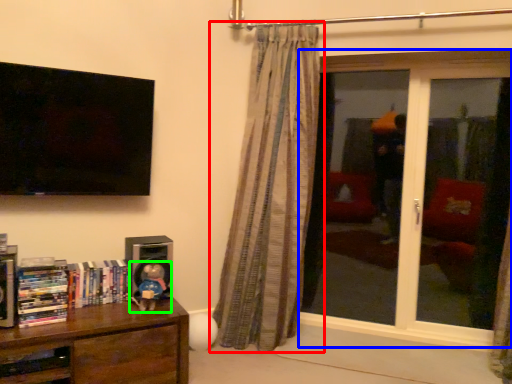
Question: Based on their relative distances, which object is farther from curtain (highlighted by a red box)? Choose from window (highlighted by a blue box) and toy (highlighted by a green box).

Choices:
 (A) window
 (B) toy

Answer: (B)